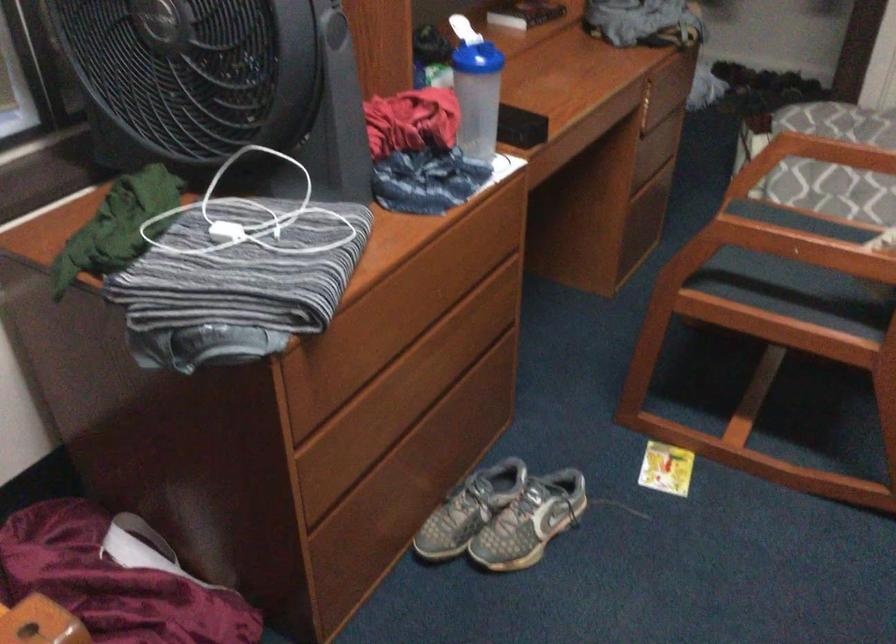
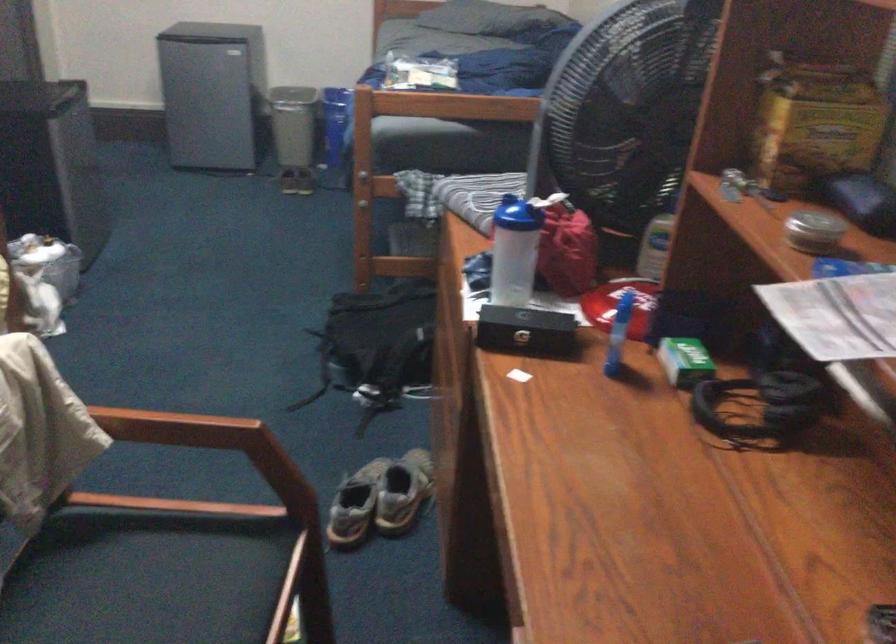
Find the pixel in the second image that matches (479,89) in the first image.

(513, 251)